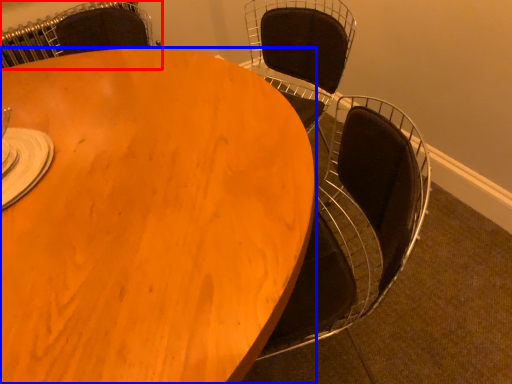
Question: Which of the following is the farthest to the observer, chair (highlighted by a red box) or table (highlighted by a blue box)?

Choices:
 (A) chair
 (B) table

Answer: (A)